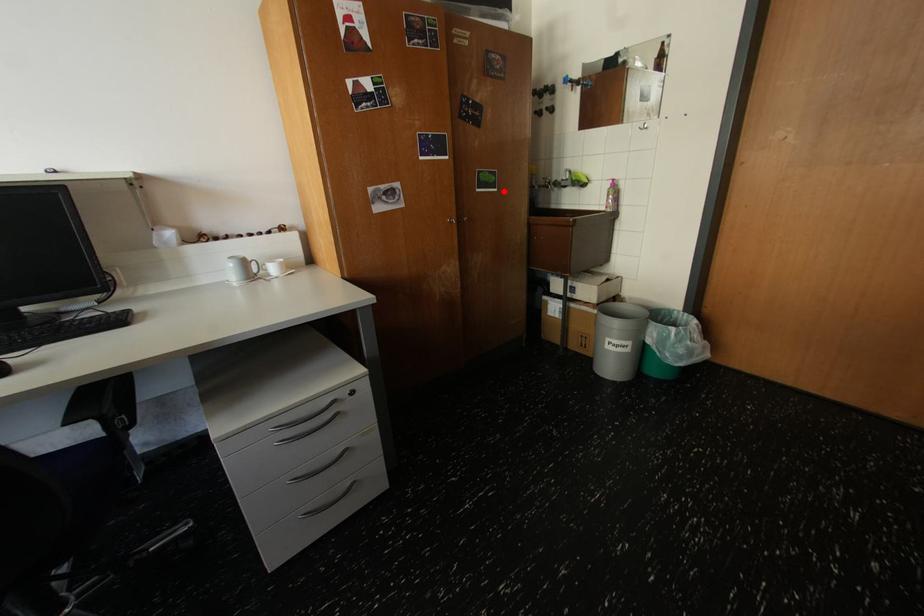
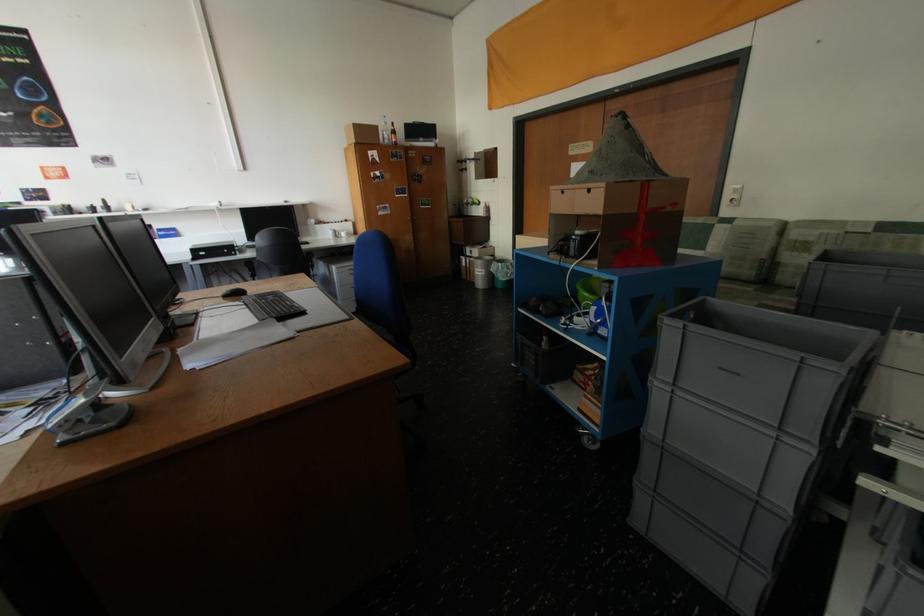
Question: I am providing you with two images of the same scene from different viewpoints. Image1 has a red point marked. In image2, the corresponding 3D location appears at what relative position? Reply with the corresponding letter.

Choices:
 (A) Closer
 (B) Farther

Answer: (A)